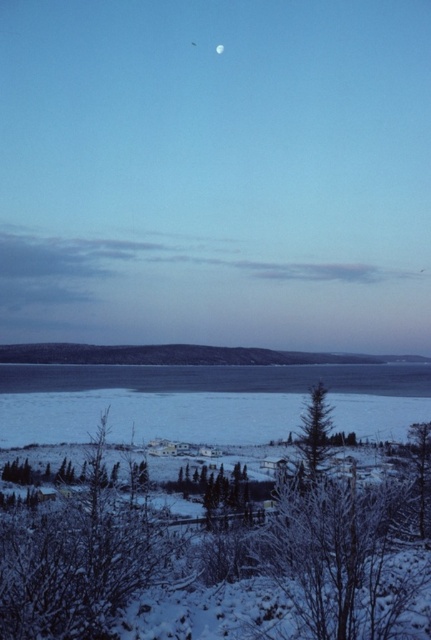
Is white ice at lower center to the right of green matte tree at center from the viewer's perspective?

No, white ice at lower center is not to the right of green matte tree at center.

Does point (69, 388) come in front of point (309, 442)?

That is False.

Which is in front, point (124, 387) or point (306, 448)?

Point (306, 448)

Identify the location of white ice at lower center. (203, 401).

Can you confirm if white ice at lower center is positioned to the right of frosty bark tree at lower left?

No, white ice at lower center is not to the right of frosty bark tree at lower left.

This screenshot has height=640, width=431. I want to click on white ice at lower center, so click(203, 401).

Does frosty bark tree at lower left appear over green matte tree at center?

Yes, frosty bark tree at lower left is above green matte tree at center.

Can you confirm if frosty bark tree at lower left is taller than green matte tree at center?

Indeed, frosty bark tree at lower left has a greater height compared to green matte tree at center.

Is point (68, 508) in front of point (321, 456)?

That is True.

Locate an element on the screen. The height and width of the screenshot is (640, 431). frosty bark tree at lower left is located at coordinates (78, 557).